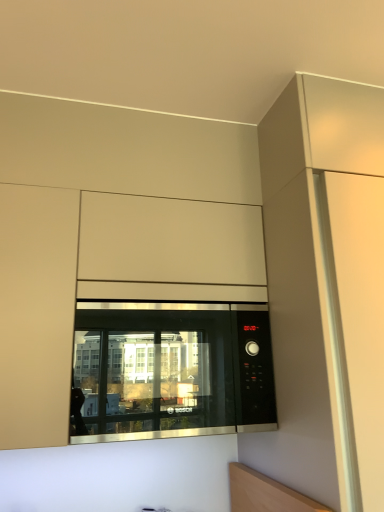
In order to face black glass microwave at center, should I rotate leftwards or rightwards?

Rotate your view left by about 3.380°.

What is the approximate width of black glass microwave at center?

black glass microwave at center is 38.18 centimeters in width.

Where is `black glass microwave at center`? The height and width of the screenshot is (512, 384). black glass microwave at center is located at coordinates (171, 370).

Describe the element at coordinates (171, 370) in the screenshot. I see `black glass microwave at center` at that location.

At what (x,y) coordinates should I click in order to perform the action: click on black glass microwave at center. Please return your answer as a coordinate pair (x, y). Looking at the image, I should click on (171, 370).